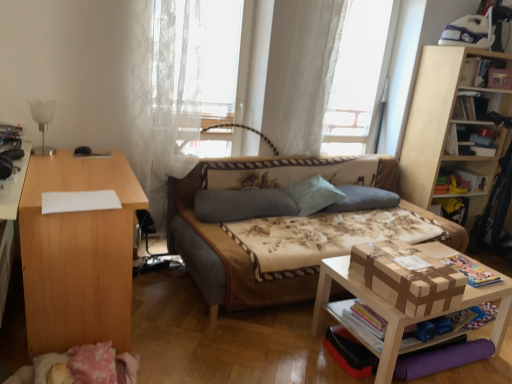
Question: Is hardcover book at upper right, which is the first book from back to front, facing away from light wood desk at left, the 2th table when ordered from right to left?

Choices:
 (A) no
 (B) yes

Answer: (A)

Question: Can you confirm if hardcover book at upper right, placed as the fourth book when sorted from front to back, is shorter than light wood desk at left, positioned as the first table in left-to-right order?

Choices:
 (A) yes
 (B) no

Answer: (A)

Question: From a real-world perspective, does hardcover book at upper right, the fourth book in the left-to-right sequence, sit lower than light wood desk at left, the 2th table when ordered from right to left?

Choices:
 (A) yes
 (B) no

Answer: (B)

Question: Is light wood desk at left, positioned as the first table in left-to-right order, surrounded by hardcover book at upper right, the fourth book in the left-to-right sequence?

Choices:
 (A) yes
 (B) no

Answer: (B)

Question: Considering the relative sizes of hardcover book at upper right, acting as the second book starting from the top, and light wood desk at left, the 2th table when ordered from right to left, in the image provided, is hardcover book at upper right, acting as the second book starting from the top, taller than light wood desk at left, the 2th table when ordered from right to left,?

Choices:
 (A) yes
 (B) no

Answer: (B)

Question: Does hardcover book at upper right, acting as the second book starting from the top, have a larger size compared to light wood desk at left, positioned as the first table in left-to-right order?

Choices:
 (A) yes
 (B) no

Answer: (B)

Question: Is hardcover book at left, which ranks as the 3th book in back-to-front order, outside of floral fabric studio couch at center?

Choices:
 (A) yes
 (B) no

Answer: (A)

Question: From the image's perspective, is hardcover book at left, which ranks as the second book in bottom-to-top order, on top of floral fabric studio couch at center?

Choices:
 (A) no
 (B) yes

Answer: (B)

Question: Are hardcover book at left, which ranks as the 3th book in back-to-front order, and floral fabric studio couch at center beside each other?

Choices:
 (A) no
 (B) yes

Answer: (A)

Question: Can you confirm if hardcover book at left, which ranks as the 3th book in back-to-front order, is wider than floral fabric studio couch at center?

Choices:
 (A) yes
 (B) no

Answer: (B)

Question: Is hardcover book at left, which ranks as the second book in bottom-to-top order, surrounding floral fabric studio couch at center?

Choices:
 (A) yes
 (B) no

Answer: (B)

Question: From the image's perspective, is hardcover book at left, positioned as the 2th book in front-to-back order, below floral fabric studio couch at center?

Choices:
 (A) no
 (B) yes

Answer: (A)

Question: Is hardcover book at upper right, which is the second book from back to front, positioned with its back to light blue fabric pillow at center, which is the 2th pillow in right-to-left order?

Choices:
 (A) yes
 (B) no

Answer: (B)